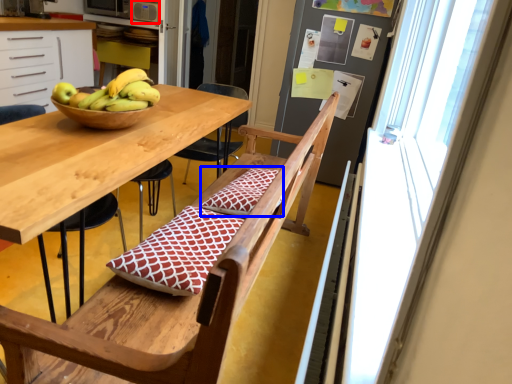
Question: Which object is closer to the camera taking this photo, appliance (highlighted by a red box) or pillow (highlighted by a blue box)?

Choices:
 (A) appliance
 (B) pillow

Answer: (B)